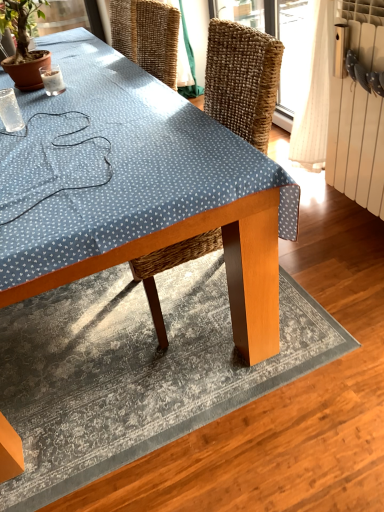
I want to click on free space in front of transparent plastic cup at upper left, which ranks as the first coffee cup in front-to-back order, so click(x=22, y=141).